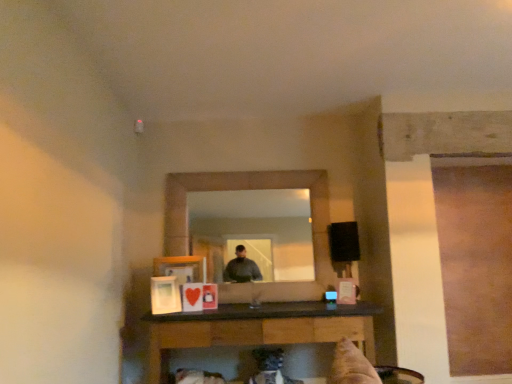
Question: From a real-world perspective, is matte wooden mirror at center physically located above or below black glossy table at lower center?

Choices:
 (A) below
 (B) above

Answer: (B)

Question: Considering the positions of matte wooden mirror at center and black glossy table at lower center in the image, is matte wooden mirror at center bigger or smaller than black glossy table at lower center?

Choices:
 (A) big
 (B) small

Answer: (B)

Question: Visually, is matte wooden mirror at center positioned to the left or to the right of black glossy table at lower center?

Choices:
 (A) right
 (B) left

Answer: (B)

Question: In the image, is black glossy table at lower center on the left side or the right side of matte wooden mirror at center?

Choices:
 (A) left
 (B) right

Answer: (B)

Question: Is black glossy table at lower center situated inside matte wooden mirror at center or outside?

Choices:
 (A) outside
 (B) inside

Answer: (A)

Question: Is point (263, 337) positioned closer to the camera than point (203, 226)?

Choices:
 (A) farther
 (B) closer

Answer: (B)

Question: Considering the positions of black glossy table at lower center and matte wooden mirror at center in the image, is black glossy table at lower center bigger or smaller than matte wooden mirror at center?

Choices:
 (A) small
 (B) big

Answer: (B)